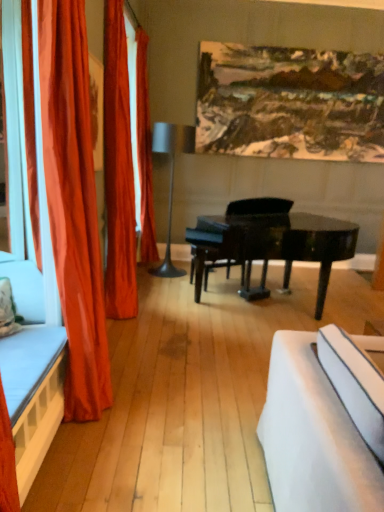
Image resolution: width=384 pixels, height=512 pixels. I want to click on metallic gray floor lamp at center, so click(x=171, y=179).

Locate an element on the screen. orange fabric curtain at left, positioned as the 1th curtain in back-to-front order is located at coordinates (144, 152).

Considering the relative sizes of orange fabric curtain at left, the 3th curtain in the front-to-back sequence, and velvet orange curtain at left, which ranks as the second curtain in front-to-back order, in the image provided, is orange fabric curtain at left, the 3th curtain in the front-to-back sequence, wider than velvet orange curtain at left, which ranks as the second curtain in front-to-back order,?

Correct, the width of orange fabric curtain at left, the 3th curtain in the front-to-back sequence, exceeds that of velvet orange curtain at left, which ranks as the second curtain in front-to-back order.

Is orange fabric curtain at left, the 3th curtain in the front-to-back sequence, located outside velvet orange curtain at left, which ranks as the second curtain in front-to-back order?

Absolutely, orange fabric curtain at left, the 3th curtain in the front-to-back sequence, is external to velvet orange curtain at left, which ranks as the second curtain in front-to-back order.

Which is in front, orange fabric curtain at left, positioned as the 1th curtain in back-to-front order, or velvet orange curtain at left, which appears as the 2th curtain when viewed from the back?

velvet orange curtain at left, which appears as the 2th curtain when viewed from the back, is closer to the camera.

From the image's perspective, is orange fabric curtain at left, positioned as the 1th curtain in back-to-front order, over velvet orange curtain at left, which ranks as the second curtain in front-to-back order?

Yes, from the image's perspective, orange fabric curtain at left, positioned as the 1th curtain in back-to-front order, is above velvet orange curtain at left, which ranks as the second curtain in front-to-back order.

Looking at this image, could you tell me if velvet orange curtain at left, which ranks as the second curtain in front-to-back order, is turned towards wooden bed frame at left?

No, velvet orange curtain at left, which ranks as the second curtain in front-to-back order, is not facing towards wooden bed frame at left.

Measure the distance between velvet orange curtain at left, which ranks as the second curtain in front-to-back order, and wooden bed frame at left.

They are 5.33 feet apart.

Find the location of a particular element. bed frame lying in front of the velvet orange curtain at left, which ranks as the second curtain in front-to-back order is located at coordinates pos(33,393).

Can we say velvet orange curtain at left, which appears as the 2th curtain when viewed from the back, lies outside wooden bed frame at left?

Absolutely, velvet orange curtain at left, which appears as the 2th curtain when viewed from the back, is external to wooden bed frame at left.

Considering the sizes of black glossy piano at center and wooden bed frame at left in the image, is black glossy piano at center bigger or smaller than wooden bed frame at left?

In the image, black glossy piano at center appears to be larger than wooden bed frame at left.

How many degrees apart are the facing directions of black glossy piano at center and wooden bed frame at left?

The angle between the facing direction of black glossy piano at center and the facing direction of wooden bed frame at left is 58.2 degrees.

Would you say black glossy piano at center contains wooden bed frame at left?

No, black glossy piano at center does not contain wooden bed frame at left.

Considering the relative sizes of satin orange curtain at left, which ranks as the 1th curtain in front-to-back order, and orange fabric curtain at left, the 3th curtain in the front-to-back sequence, in the image provided, is satin orange curtain at left, which ranks as the 1th curtain in front-to-back order, thinner than orange fabric curtain at left, the 3th curtain in the front-to-back sequence,?

Correct, the width of satin orange curtain at left, which ranks as the 1th curtain in front-to-back order, is less than that of orange fabric curtain at left, the 3th curtain in the front-to-back sequence.

Considering the sizes of satin orange curtain at left, which is the third curtain from back to front, and orange fabric curtain at left, positioned as the 1th curtain in back-to-front order, in the image, is satin orange curtain at left, which is the third curtain from back to front, taller or shorter than orange fabric curtain at left, positioned as the 1th curtain in back-to-front order,?

Considering their sizes, satin orange curtain at left, which is the third curtain from back to front, has less height than orange fabric curtain at left, positioned as the 1th curtain in back-to-front order.

Does satin orange curtain at left, which ranks as the 1th curtain in front-to-back order, appear on the left side of orange fabric curtain at left, positioned as the 1th curtain in back-to-front order?

Indeed, satin orange curtain at left, which ranks as the 1th curtain in front-to-back order, is positioned on the left side of orange fabric curtain at left, positioned as the 1th curtain in back-to-front order.

Consider the image. Do you think satin orange curtain at left, which ranks as the 1th curtain in front-to-back order, is within orange fabric curtain at left, positioned as the 1th curtain in back-to-front order, or outside of it?

satin orange curtain at left, which ranks as the 1th curtain in front-to-back order, is located beyond the bounds of orange fabric curtain at left, positioned as the 1th curtain in back-to-front order.

From a real-world perspective, which curtain is the 1st one underneath the orange fabric curtain at left, positioned as the 1th curtain in back-to-front order? Please provide its 2D coordinates.

[(118, 170)]

Which is more to the left, velvet orange curtain at left, which appears as the 2th curtain when viewed from the back, or orange fabric curtain at left, the 3th curtain in the front-to-back sequence?

velvet orange curtain at left, which appears as the 2th curtain when viewed from the back, is more to the left.

Who is shorter, velvet orange curtain at left, which appears as the 2th curtain when viewed from the back, or orange fabric curtain at left, the 3th curtain in the front-to-back sequence?

velvet orange curtain at left, which appears as the 2th curtain when viewed from the back, is shorter.

From the image's perspective, does satin orange curtain at left, which is the third curtain from back to front, appear lower than metallic gray floor lamp at center?

Indeed, from the image's perspective, satin orange curtain at left, which is the third curtain from back to front, is shown beneath metallic gray floor lamp at center.

Does point (58, 151) appear closer or farther from the camera than point (185, 139)?

Point (58, 151) appears to be closer to the viewer than point (185, 139).

Is satin orange curtain at left, which is the third curtain from back to front, not inside metallic gray floor lamp at center?

Yes.

Would you say satin orange curtain at left, which ranks as the 1th curtain in front-to-back order, is to the left or to the right of metallic gray floor lamp at center in the picture?

satin orange curtain at left, which ranks as the 1th curtain in front-to-back order, is to the left of metallic gray floor lamp at center.

Considering the relative positions of satin orange curtain at left, which is the third curtain from back to front, and black glossy piano at center in the image provided, is satin orange curtain at left, which is the third curtain from back to front, in front of black glossy piano at center?

Yes, the depth of satin orange curtain at left, which is the third curtain from back to front, is less than that of black glossy piano at center.

Based on the photo, looking at the image, does satin orange curtain at left, which ranks as the 1th curtain in front-to-back order, seem bigger or smaller compared to black glossy piano at center?

In the image, satin orange curtain at left, which ranks as the 1th curtain in front-to-back order, appears to be smaller than black glossy piano at center.

Is black glossy piano at center completely or partially inside satin orange curtain at left, which is the third curtain from back to front?

No, black glossy piano at center is not inside satin orange curtain at left, which is the third curtain from back to front.

Identify the location of curtain behind the velvet orange curtain at left, which appears as the 2th curtain when viewed from the back. (144, 152).

Image resolution: width=384 pixels, height=512 pixels. Identify the location of bed frame below the velvet orange curtain at left, which ranks as the second curtain in front-to-back order (from the image's perspective). (33, 393).

When comparing their distances from black glossy piano at center, does wooden bed frame at left or metallic gray floor lamp at center seem closer?

The object closer to black glossy piano at center is metallic gray floor lamp at center.

Considering their positions, is satin orange curtain at left, which ranks as the 1th curtain in front-to-back order, positioned closer to black glossy piano at center than metallic gray floor lamp at center?

metallic gray floor lamp at center lies closer to black glossy piano at center than the other object.

Looking at the image, which one is located further to satin orange curtain at left, which is the third curtain from back to front, orange fabric curtain at left, the 3th curtain in the front-to-back sequence, or wooden bed frame at left?

The object further to satin orange curtain at left, which is the third curtain from back to front, is orange fabric curtain at left, the 3th curtain in the front-to-back sequence.

Considering their positions, is velvet orange curtain at left, which appears as the 2th curtain when viewed from the back, positioned closer to black glossy piano at center than satin orange curtain at left, which ranks as the 1th curtain in front-to-back order?

velvet orange curtain at left, which appears as the 2th curtain when viewed from the back.

Which object lies further to the anchor point satin orange curtain at left, which is the third curtain from back to front, velvet orange curtain at left, which ranks as the second curtain in front-to-back order, or metallic gray floor lamp at center?

The object further to satin orange curtain at left, which is the third curtain from back to front, is metallic gray floor lamp at center.

Considering their positions, is black glossy piano at center positioned closer to orange fabric curtain at left, the 3th curtain in the front-to-back sequence, than metallic gray floor lamp at center?

The object closer to orange fabric curtain at left, the 3th curtain in the front-to-back sequence, is metallic gray floor lamp at center.

When comparing their distances from velvet orange curtain at left, which appears as the 2th curtain when viewed from the back, does wooden bed frame at left or metallic gray floor lamp at center seem closer?

The object closer to velvet orange curtain at left, which appears as the 2th curtain when viewed from the back, is wooden bed frame at left.

From the image, which object appears to be nearer to black glossy piano at center, wooden bed frame at left or satin orange curtain at left, which ranks as the 1th curtain in front-to-back order?

Among the two, satin orange curtain at left, which ranks as the 1th curtain in front-to-back order, is located nearer to black glossy piano at center.

The image size is (384, 512). What are the coordinates of `curtain between velvet orange curtain at left, which ranks as the second curtain in front-to-back order, and metallic gray floor lamp at center, along the z-axis` in the screenshot? It's located at tap(144, 152).

You are a GUI agent. You are given a task and a screenshot of the screen. Output one action in this format:
    pyautogui.click(x=<x>, y=<y>)
    Task: Click on the piano between satin orange curtain at left, which ranks as the 1th curtain in front-to-back order, and orange fabric curtain at left, positioned as the 1th curtain in back-to-front order, along the z-axis
    The width and height of the screenshot is (384, 512).
    Given the screenshot: What is the action you would take?
    pyautogui.click(x=272, y=246)

Locate an element on the screen. This screenshot has height=512, width=384. piano located between wooden bed frame at left and orange fabric curtain at left, the 3th curtain in the front-to-back sequence, in the depth direction is located at coordinates (272, 246).

Image resolution: width=384 pixels, height=512 pixels. Find the location of `curtain located between satin orange curtain at left, which is the third curtain from back to front, and orange fabric curtain at left, the 3th curtain in the front-to-back sequence, in the depth direction`. curtain located between satin orange curtain at left, which is the third curtain from back to front, and orange fabric curtain at left, the 3th curtain in the front-to-back sequence, in the depth direction is located at coordinates (118, 170).